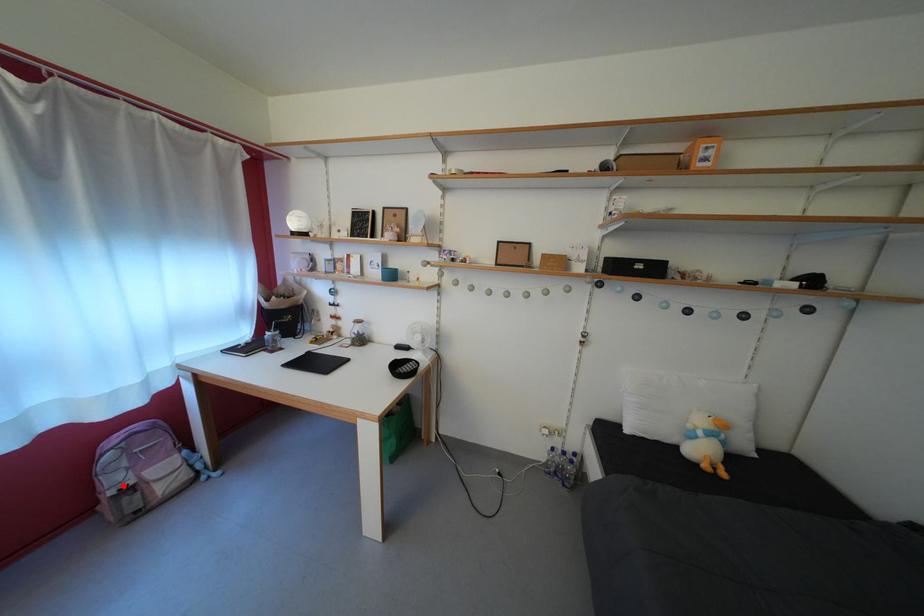
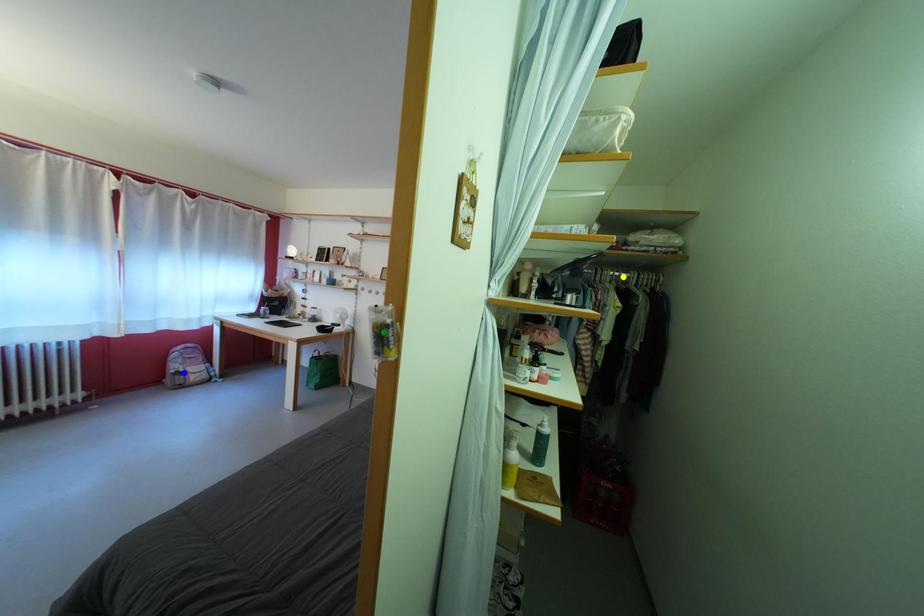
Question: I am providing you with two images of the same scene from different viewpoints. A red point is marked on the first image. You are given multiple points on the second image. Which spot in image 2 lines up with the point in image 1?

Choices:
 (A) green point
 (B) blue point
 (C) yellow point

Answer: (B)